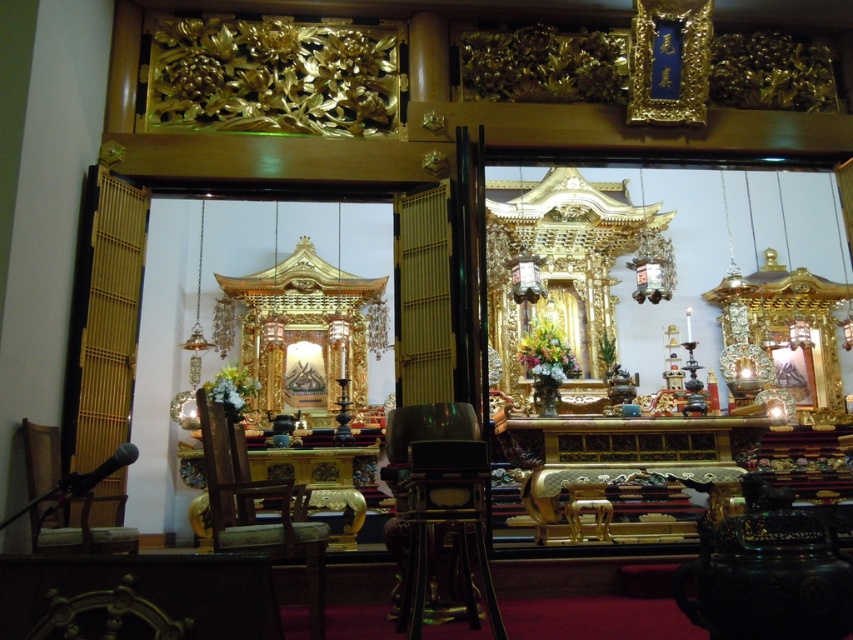
You are standing in the shrine and want to place a 1.2 meter long ceremonial scroll on the floor between you and the wooden chair at center. Is there enough space?

The distance between you and the wooden chair at center is 11.69 meters, so yes, there is enough space to place the 1.2 meter long ceremonial scroll between you and the wooden chair at center.

Looking at this image, you are standing in the shrine and want to place a small offering at the closest point between point (212, 404) and point (123, 608). Which point should you approach?

You should approach point (123, 608) because it is closer to you than point (212, 404), which is further away.